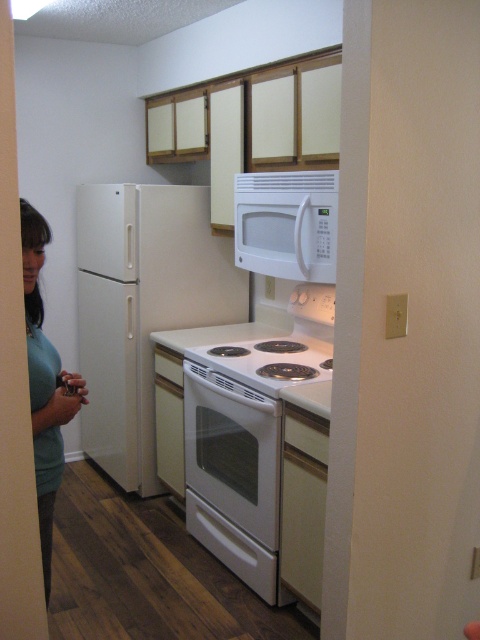
Question: Considering the relative positions of white glossy refrigerator at left and white matte microwave at upper center in the image provided, where is white glossy refrigerator at left located with respect to white matte microwave at upper center?

Choices:
 (A) above
 (B) below

Answer: (B)

Question: Estimate the real-world distances between objects in this image. Which object is closer to the white glossy oven at center?

Choices:
 (A) white glossy stove at center
 (B) green matte shirt at lower left

Answer: (A)

Question: Which object is closer to the camera taking this photo?

Choices:
 (A) white glossy refrigerator at left
 (B) white matte microwave at upper center
 (C) white glossy oven at center
 (D) white glossy stove at center

Answer: (B)

Question: Based on their relative distances, which object is farther from the green matte shirt at lower left?

Choices:
 (A) white glossy refrigerator at left
 (B) white matte microwave at upper center
 (C) white glossy oven at center

Answer: (A)

Question: Can you confirm if white matte microwave at upper center is thinner than green matte shirt at lower left?

Choices:
 (A) no
 (B) yes

Answer: (A)

Question: Can you confirm if white matte microwave at upper center is thinner than white glossy stove at center?

Choices:
 (A) no
 (B) yes

Answer: (B)